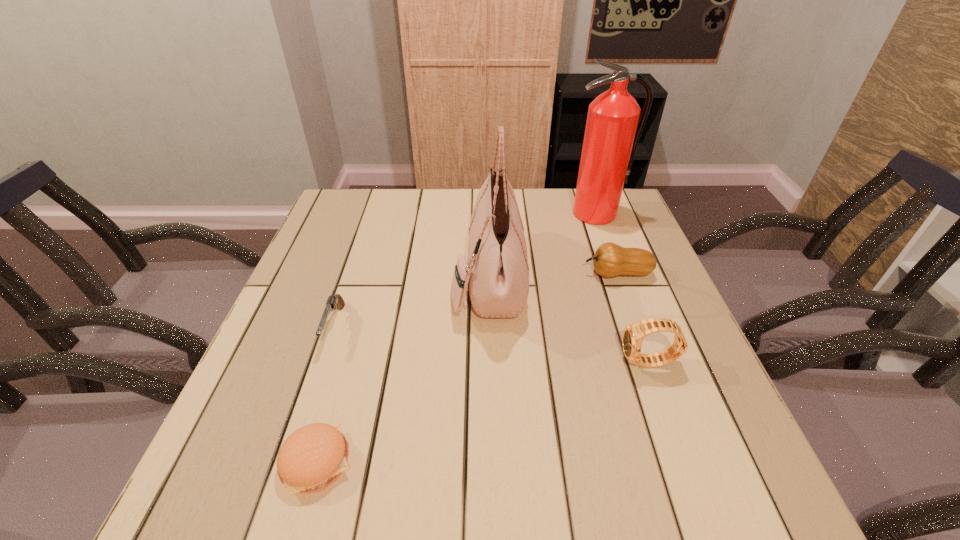
I want to click on free spot at the near edge of the desktop, so click(x=349, y=489).

Locate an element on the screen. This screenshot has width=960, height=540. free space at the left edge is located at coordinates (293, 302).

Identify the location of vacant region at the right edge of the desktop. (636, 239).

Where is `free location at the far right corner`? This screenshot has height=540, width=960. free location at the far right corner is located at coordinates (624, 197).

The width and height of the screenshot is (960, 540). I want to click on free space that is in between the third shortest object and the fourth object from right to left, so click(x=553, y=275).

Locate an element on the screen. The height and width of the screenshot is (540, 960). vacant area between the handbag and the gourd is located at coordinates (553, 275).

Where is `unoccupied position between the third shortest object and the handbag`? This screenshot has height=540, width=960. unoccupied position between the third shortest object and the handbag is located at coordinates (553, 275).

Locate an element on the screen. This screenshot has width=960, height=540. free space between the watch and the gun is located at coordinates (492, 345).

Locate an element on the screen. vacant space that's between the nearest object and the watch is located at coordinates (483, 413).

Locate an element on the screen. This screenshot has height=540, width=960. empty space between the nearest object and the gun is located at coordinates (325, 394).